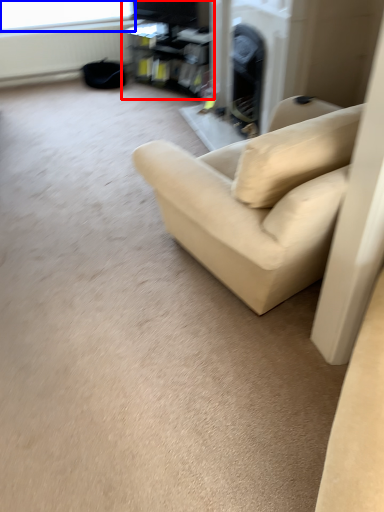
Question: Among these objects, which one is nearest to the camera, entertainment center (highlighted by a red box) or window screen (highlighted by a blue box)?

Choices:
 (A) entertainment center
 (B) window screen

Answer: (A)